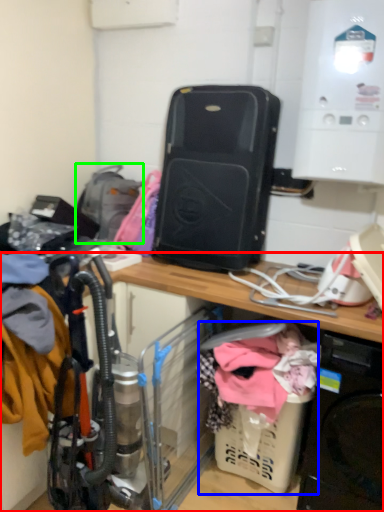
Question: Estimate the real-world distances between objects in this image. Which object is closer to desk (highlighted by a red box), baby carriage (highlighted by a blue box) or backpack (highlighted by a green box)?

Choices:
 (A) baby carriage
 (B) backpack

Answer: (A)